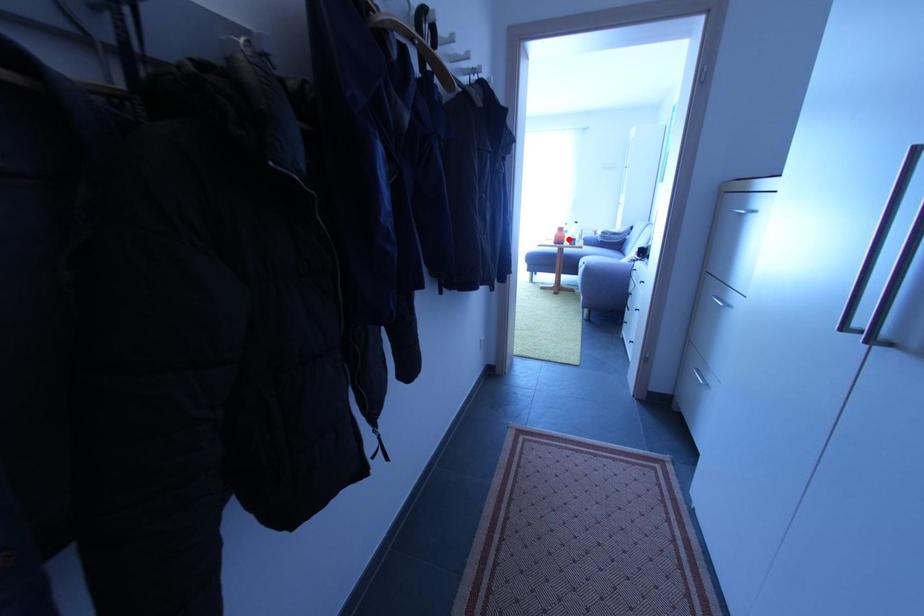
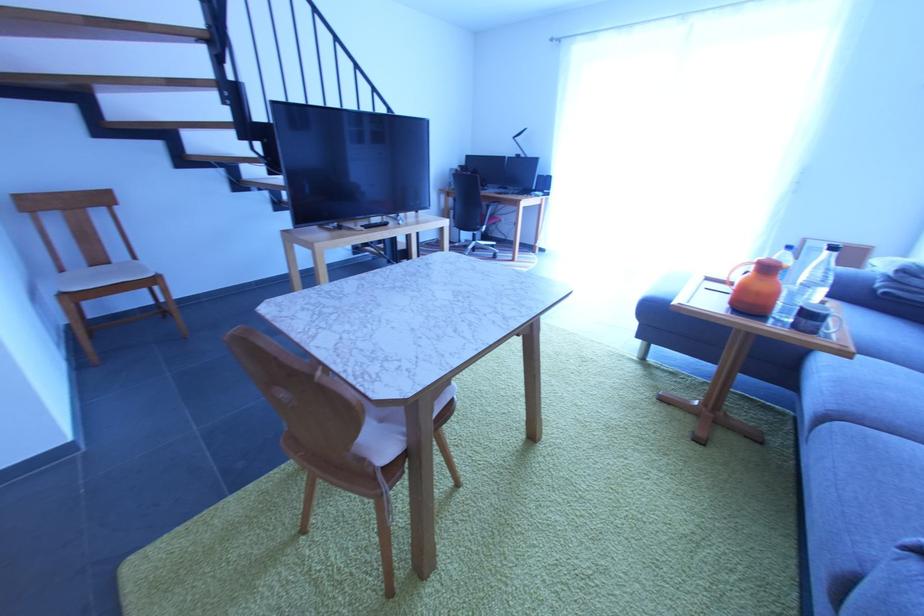
In the second image, find the point that corresponds to the highlighted location in the first image.

(779, 297)